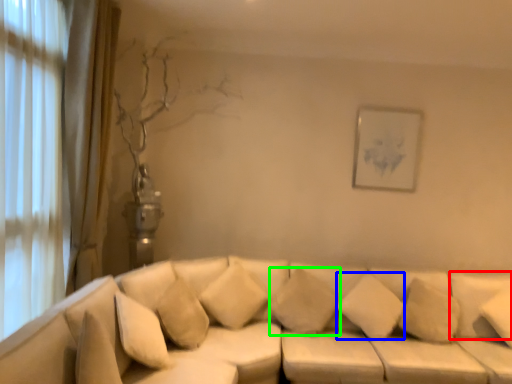
Question: Estimate the real-world distances between objects in this image. Which object is closer to pillow (highlighted by a red box), pillow (highlighted by a blue box) or pillow (highlighted by a green box)?

Choices:
 (A) pillow
 (B) pillow

Answer: (A)